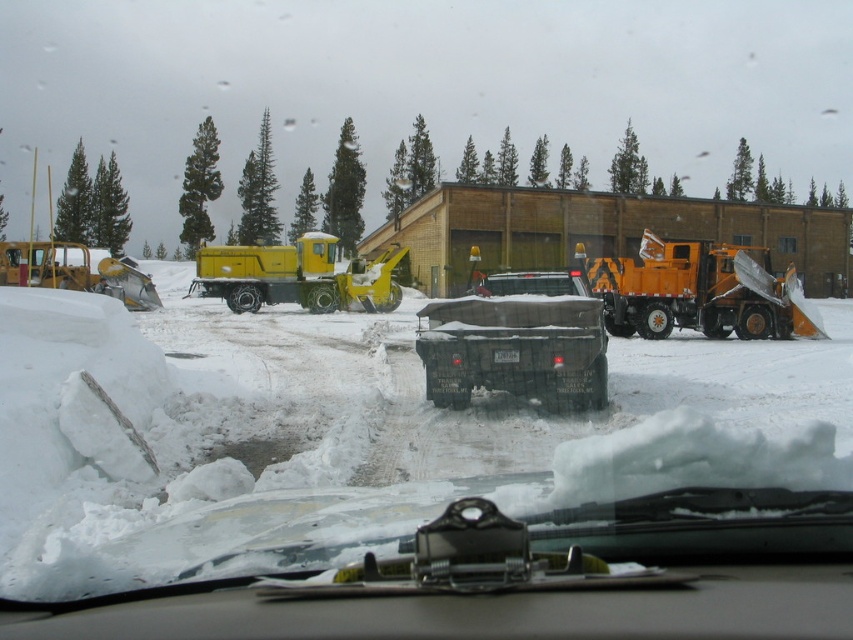
The image size is (853, 640). What do you see at coordinates (699, 291) in the screenshot?
I see `orange metallic snowplow at right` at bounding box center [699, 291].

Is orange metallic snowplow at right shorter than yellow rubber snowplow at left?

Incorrect, orange metallic snowplow at right's height does not fall short of yellow rubber snowplow at left's.

What do you see at coordinates (699, 291) in the screenshot?
I see `orange metallic snowplow at right` at bounding box center [699, 291].

Locate an element on the screen. The width and height of the screenshot is (853, 640). orange metallic snowplow at right is located at coordinates (699, 291).

Does white fluffy snow at center have a smaller size compared to black matte truck at center?

Incorrect, white fluffy snow at center is not smaller in size than black matte truck at center.

Does white fluffy snow at center have a lesser height compared to black matte truck at center?

Yes, white fluffy snow at center is shorter than black matte truck at center.

This screenshot has width=853, height=640. Describe the element at coordinates (350, 433) in the screenshot. I see `white fluffy snow at center` at that location.

Locate an element on the screen. This screenshot has width=853, height=640. white fluffy snow at center is located at coordinates 350,433.

Which of these two, orange metallic snowplow at right or yellow matte truck at center, stands taller?

orange metallic snowplow at right is taller.

Does point (619, 300) come behind point (306, 234)?

No, (619, 300) is closer to viewer.

The image size is (853, 640). I want to click on orange metallic snowplow at right, so click(x=699, y=291).